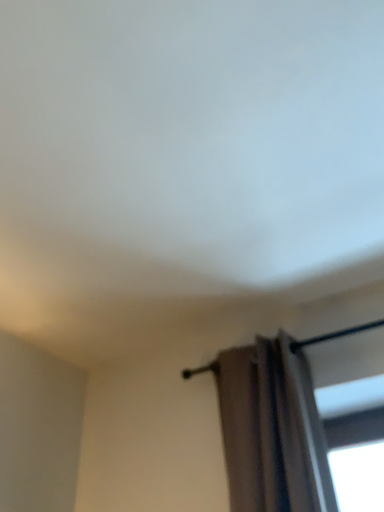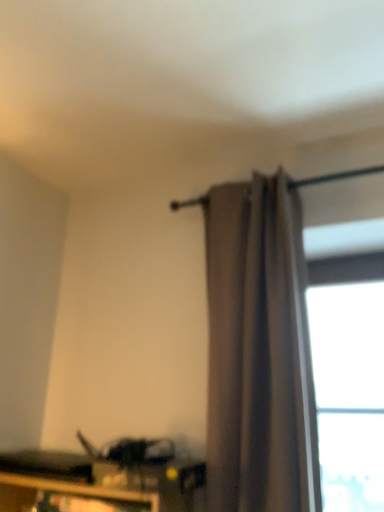
Question: Which way did the camera rotate in the video?

Choices:
 (A) rotated upward
 (B) rotated downward

Answer: (B)